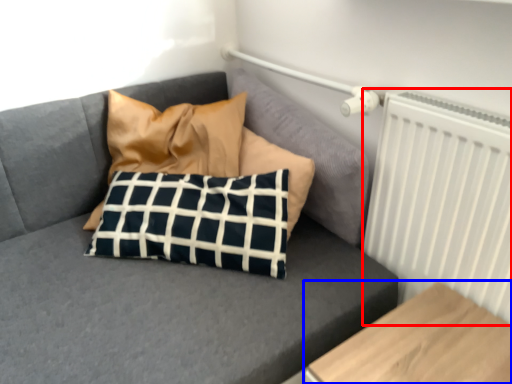
Question: Which point is further to the camera, radiator (highlighted by a red box) or furniture (highlighted by a blue box)?

Choices:
 (A) radiator
 (B) furniture

Answer: (A)